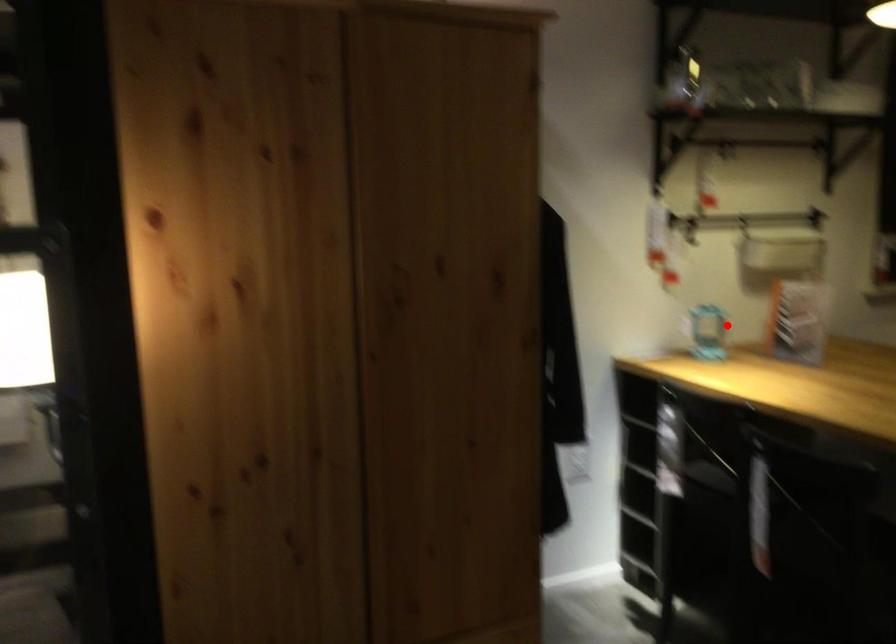
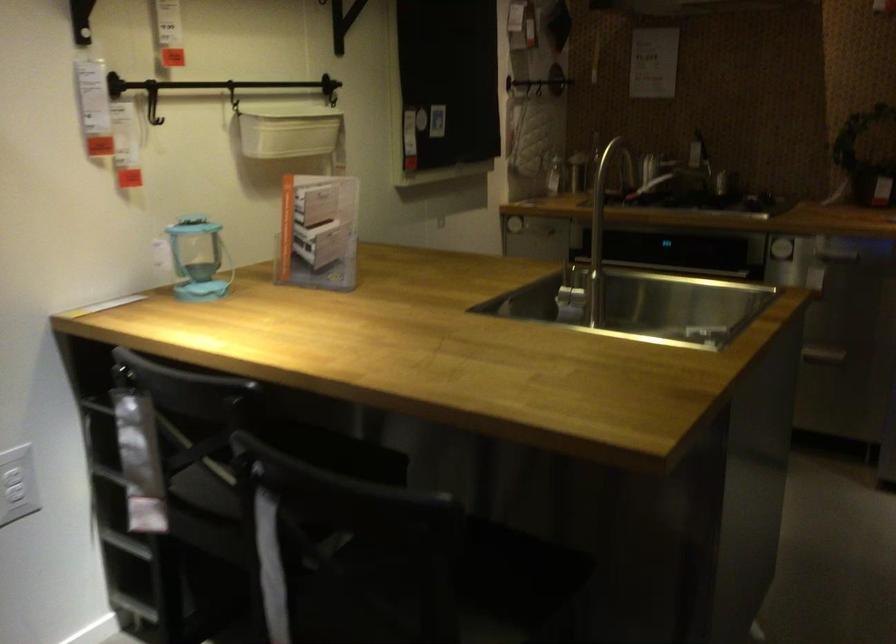
Question: I am providing you with two images of the same scene from different viewpoints. A red point is shown in image1. For the corresponding object point in image2, is it positioned nearer or farther from the camera?

Choices:
 (A) Nearer
 (B) Farther

Answer: (A)